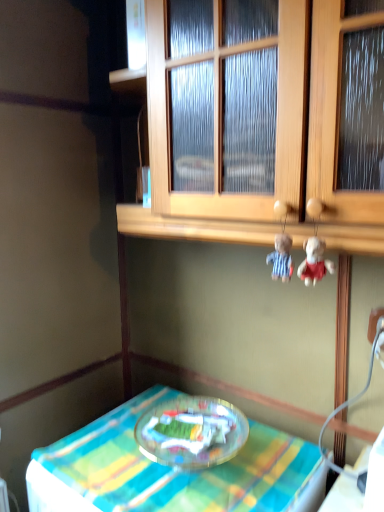
Describe the element at coordinates (171, 471) in the screenshot. This screenshot has height=512, width=384. I see `translucent plastic plate at lower center` at that location.

Locate an element on the screen. The width and height of the screenshot is (384, 512). translucent plastic plate at lower center is located at coordinates (171, 471).

You are a GUI agent. You are given a task and a screenshot of the screen. Output one action in this format:
    pyautogui.click(x=<x>, y=<y>)
    Task: Click on the translucent plastic plate at lower center
    This screenshot has width=384, height=512.
    Given the screenshot: What is the action you would take?
    pyautogui.click(x=171, y=471)